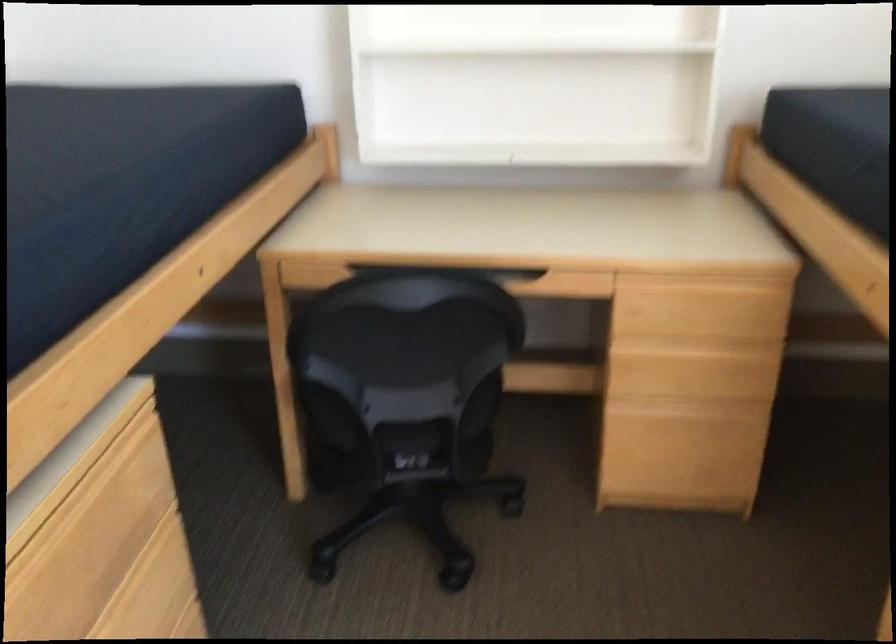
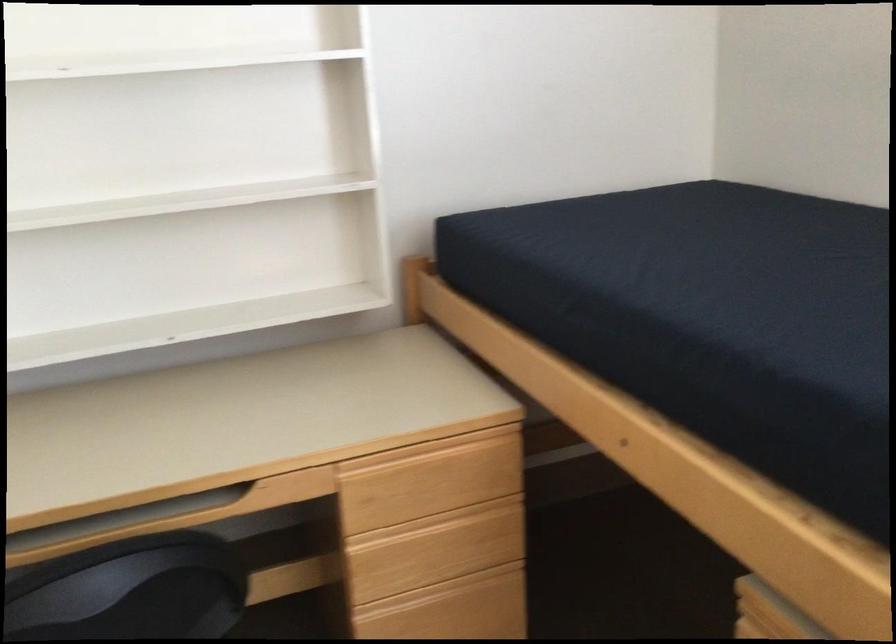
Question: The first image is from the beginning of the video and the second image is from the end. How did the camera likely rotate when shooting the video?

Choices:
 (A) Left
 (B) Right
 (C) Up
 (D) Down

Answer: (B)